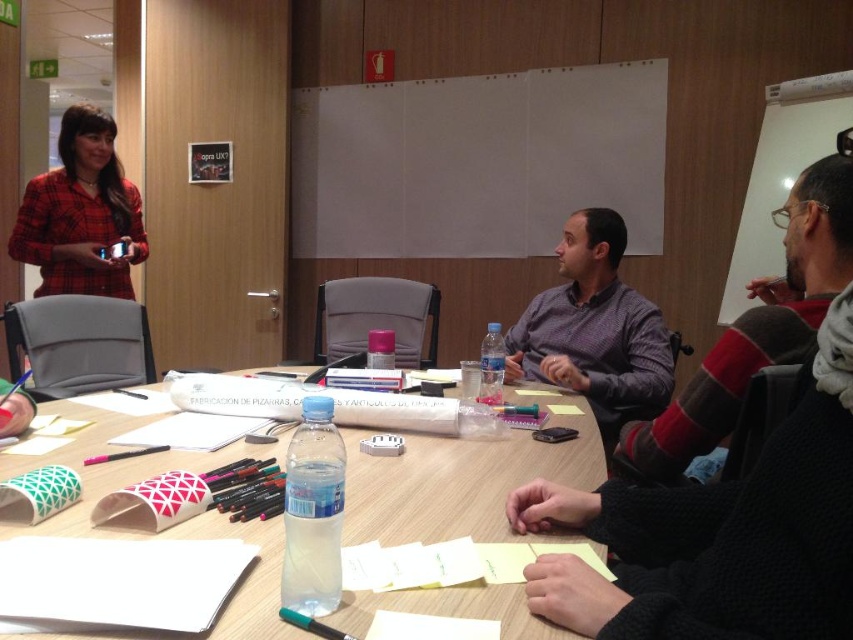
Which object is located at the coordinates point (753, 330)?

The point (753, 330) marks the striped sweater at right.

You are standing at the entrance of the meeting room. The entrance is at point 0.0. You want to walk to the wooden table at center. Which direction should you walk?

Since the wooden table at center is located at point 0.755, you should walk forward towards the center of the room to reach it.

You are organizing a group photo and need to arrange the participants from the narrowest to widest based on their clothing. Which order should you place the striped sweater at right and the red plaid shirt at upper left?

The striped sweater at right has a lesser width compared to the red plaid shirt at upper left, so the order from narrowest to widest would be striped sweater at right first, followed by the red plaid shirt at upper left.